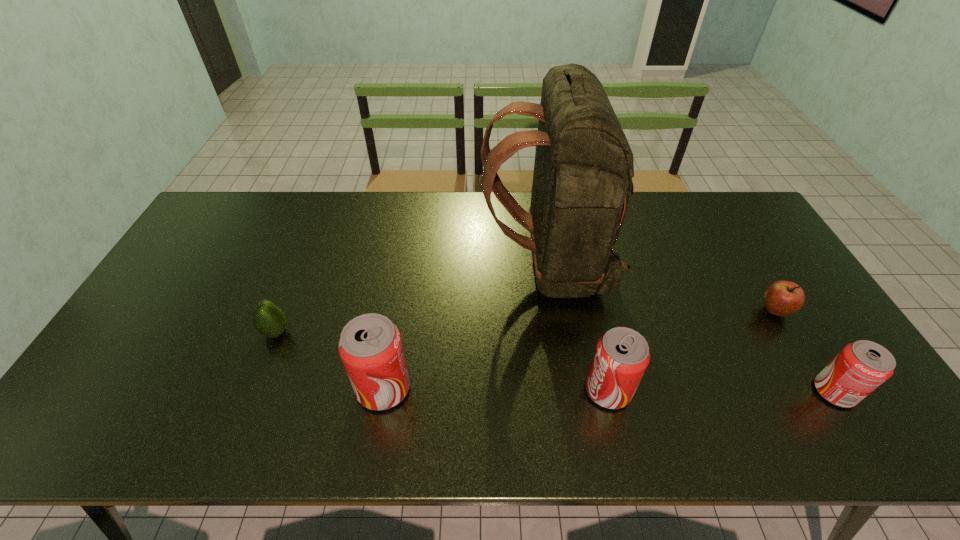
Locate an element on the screen. The height and width of the screenshot is (540, 960). free spot at the far edge of the desktop is located at coordinates (335, 199).

Find the location of a particular element. The height and width of the screenshot is (540, 960). vacant space at the near edge of the desktop is located at coordinates (513, 379).

In the image, there is a desktop. Identify the location of free space at the right edge. (764, 238).

Where is `blank space at the far left corner of the desktop`? blank space at the far left corner of the desktop is located at coordinates (223, 201).

In the image, there is a desktop. Identify the location of vacant area at the far right corner. (702, 210).

Identify the location of free space at the near right corner. (816, 373).

Where is `free area in between the avocado and the rightmost soda can`? The image size is (960, 540). free area in between the avocado and the rightmost soda can is located at coordinates (555, 362).

Image resolution: width=960 pixels, height=540 pixels. I want to click on free spot between the tallest object and the apple, so click(660, 288).

Where is `empty location between the avocado and the apple`? The image size is (960, 540). empty location between the avocado and the apple is located at coordinates (525, 322).

I want to click on free space between the tallest object and the fourth shortest object, so click(578, 328).